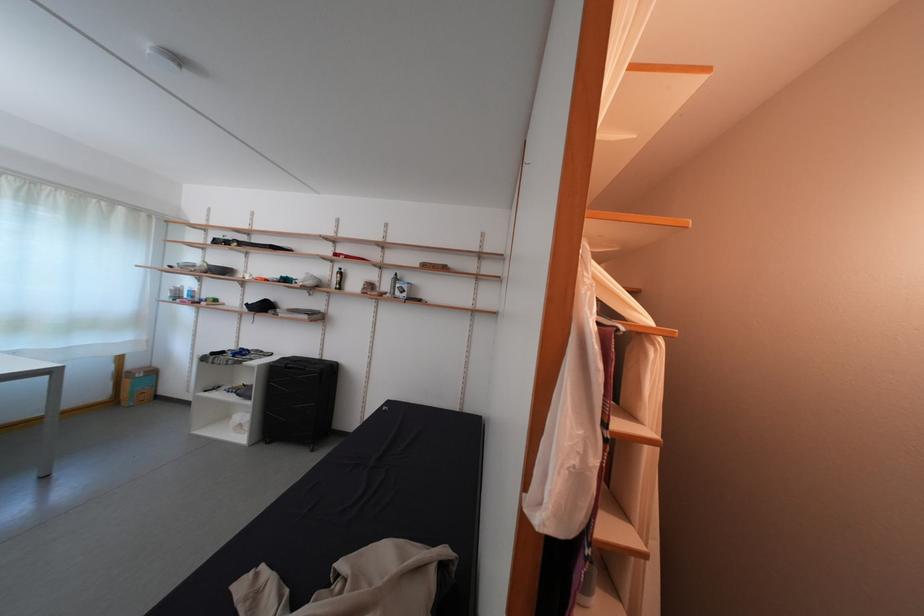
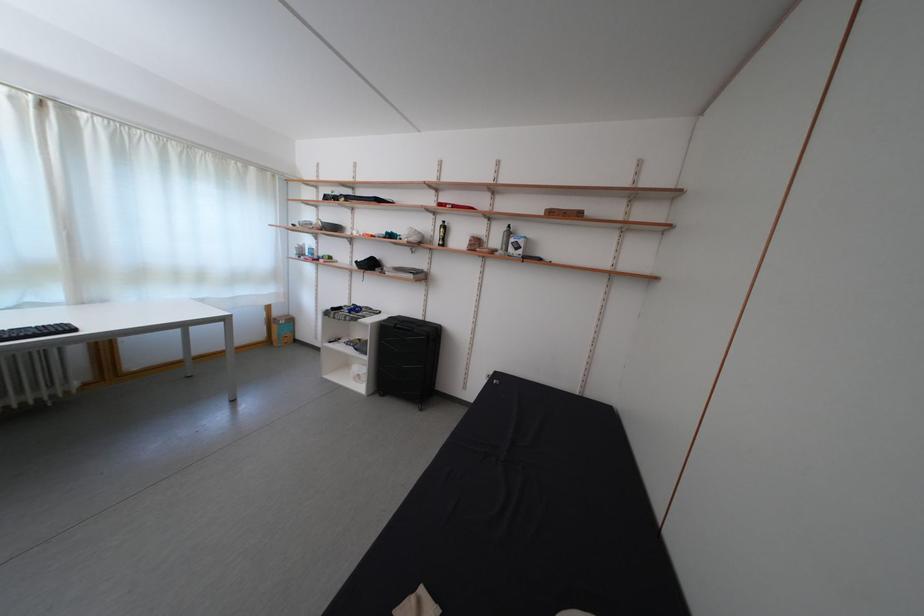
The images are taken continuously from a first-person perspective. In which direction are you moving?

The cameraman walked toward left, forward.